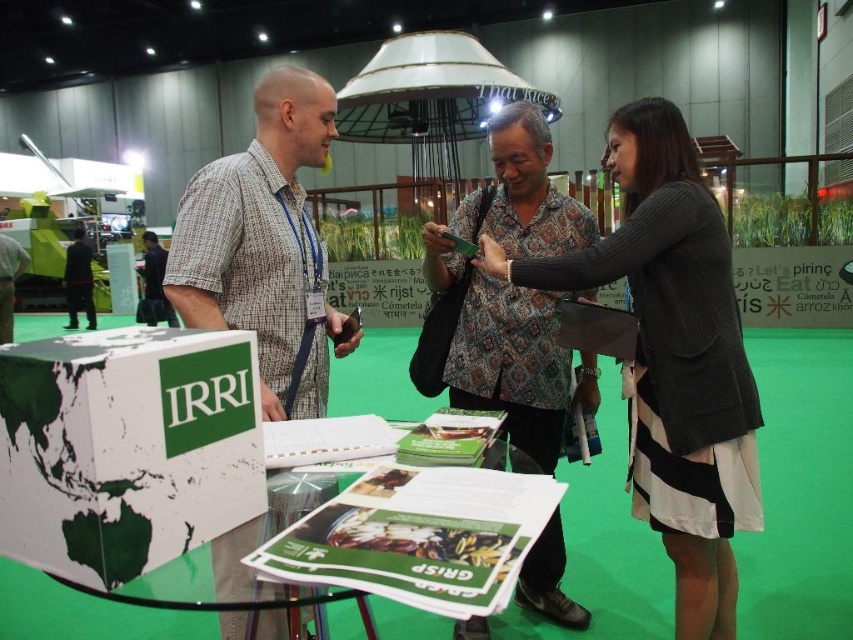
Which is behind, point (285, 131) or point (137, 321)?

The point (137, 321) is more distant.

Who is taller, plaid shirt at center or matte black shirt at center?

matte black shirt at center is taller.

Between point (254, 188) and point (166, 320), which one is positioned in front?

Positioned in front is point (254, 188).

Locate an element on the screen. plaid shirt at center is located at coordinates (263, 244).

Can you confirm if white paperboard box at center is smaller than patterned fabric shirt at center?

Yes.

Is point (85, 513) positioned before point (527, 356)?

Yes, it is.

Where is `white paperboard box at center`? white paperboard box at center is located at coordinates (126, 449).

Who is more forward, (x=349, y=348) or (x=439, y=253)?

Positioned in front is point (x=349, y=348).

Is plaid shirt at center taller than patterned fabric shirt at center?

In fact, plaid shirt at center may be shorter than patterned fabric shirt at center.

The height and width of the screenshot is (640, 853). I want to click on plaid shirt at center, so click(x=263, y=244).